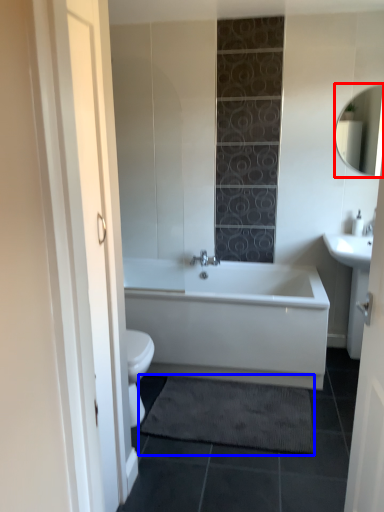
Question: Which point is closer to the camera, mirror (highlighted by a red box) or bath mat (highlighted by a blue box)?

Choices:
 (A) mirror
 (B) bath mat

Answer: (B)